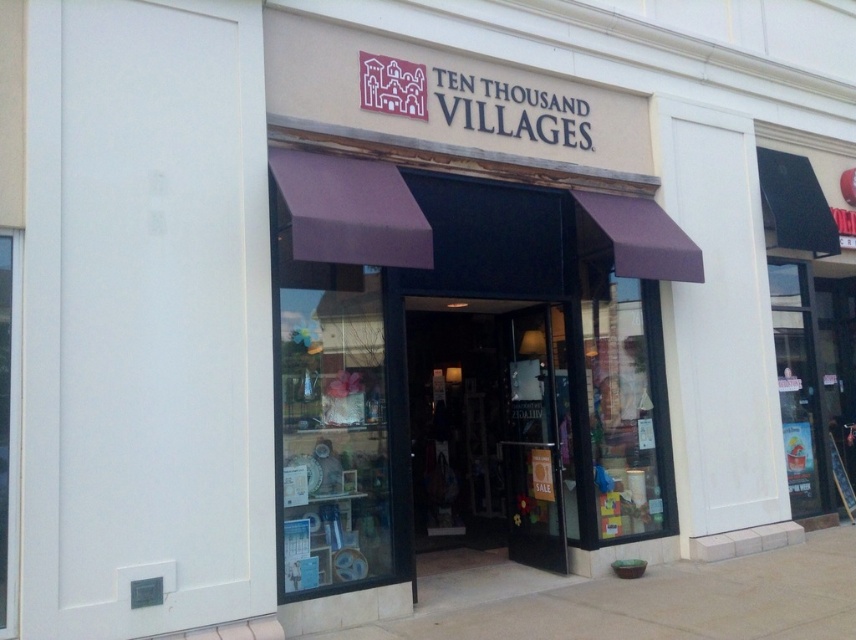
You are a delivery person trying to load a tall package into your van. The package is 2 meters tall. You need to know if the purple fabric awning at center and the transparent glass door at center will allow the package to pass through the entrance without hitting anything. Can you confirm if the package will fit vertically?

The purple fabric awning at center is taller than the transparent glass door at center. Since the package is 2 meters tall, you need to ensure the shortest vertical clearance is sufficient. The transparent glass door at center is shorter than the awning, so the package may hit the awning if the door is the limiting factor. Wait, no. Wait, the awning is above the door. The vertical clearance is determined by the door height. The awning is above, so the package height must be less than the door height. Since

You are a delivery person with a box that is 2 meters long. You need to carry the box through the entrance of the store. Can you fit the box horizontally between the purple fabric awning at center and the transparent glass door at center?

A: The distance between the purple fabric awning at center and the transparent glass door at center is 2.09 meters. Since the box is 2 meters long, it can fit horizontally between them as there is enough space.